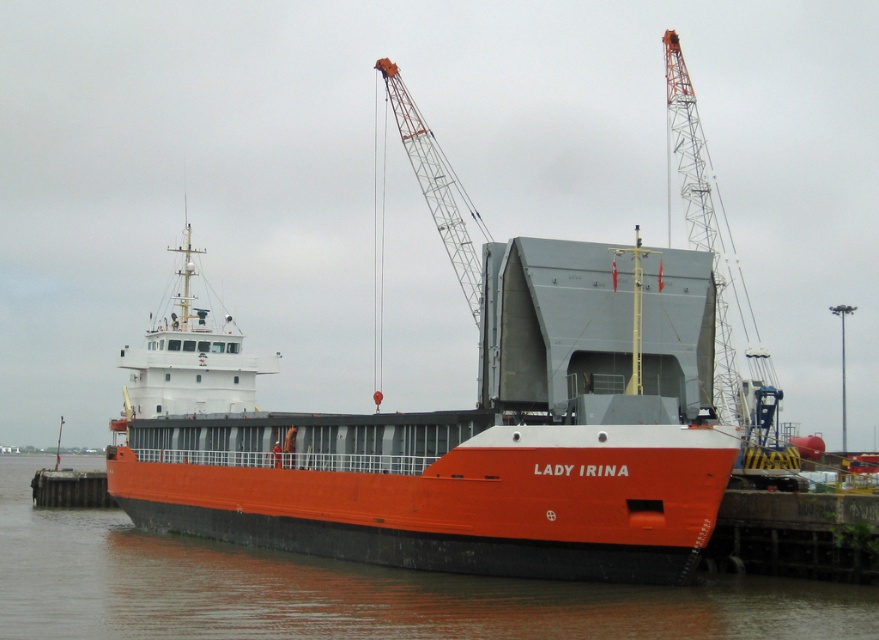
Question: Does orange matte cargo ship at center appear over metallic gray crane at upper center?

Choices:
 (A) no
 (B) yes

Answer: (A)

Question: Which object is positioned farthest from the metallic gray crane at upper right?

Choices:
 (A) smooth concrete dock at lower left
 (B) orange matte water at lower center

Answer: (A)

Question: Is metallic gray crane at upper right positioned at the back of smooth concrete dock at lower left?

Choices:
 (A) no
 (B) yes

Answer: (A)

Question: Which of the following is the closest to the observer?

Choices:
 (A) (93, 477)
 (B) (426, 136)

Answer: (B)

Question: Can you confirm if orange matte water at lower center is bigger than smooth concrete dock at lower left?

Choices:
 (A) no
 (B) yes

Answer: (B)

Question: Which point is farther to the camera?

Choices:
 (A) orange matte cargo ship at center
 (B) metallic gray crane at upper right

Answer: (B)